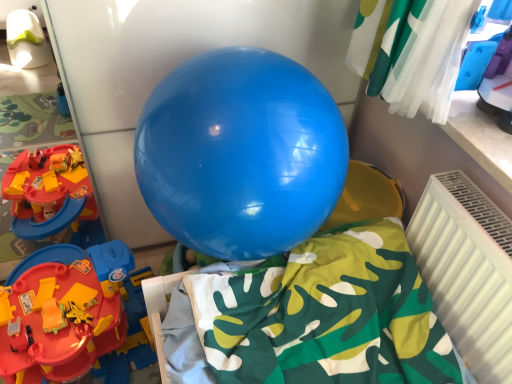
Question: Is white plastic radiator at lower right to the left of rubberized plastic track at left from the viewer's perspective?

Choices:
 (A) yes
 (B) no

Answer: (B)

Question: Is white plastic radiator at lower right at the right side of rubberized plastic track at left?

Choices:
 (A) yes
 (B) no

Answer: (A)

Question: Is white plastic radiator at lower right further to the viewer compared to rubberized plastic track at left?

Choices:
 (A) no
 (B) yes

Answer: (A)

Question: Considering the relative sizes of white plastic radiator at lower right and rubberized plastic track at left in the image provided, is white plastic radiator at lower right taller than rubberized plastic track at left?

Choices:
 (A) no
 (B) yes

Answer: (B)

Question: Is white plastic radiator at lower right not within rubberized plastic track at left?

Choices:
 (A) yes
 (B) no

Answer: (A)

Question: Can you confirm if white plastic radiator at lower right is bigger than rubberized plastic track at left?

Choices:
 (A) no
 (B) yes

Answer: (A)

Question: From the image's perspective, is glossy blue balloon at center below rubberized plastic track at left?

Choices:
 (A) no
 (B) yes

Answer: (A)

Question: Is glossy blue balloon at center thinner than rubberized plastic track at left?

Choices:
 (A) no
 (B) yes

Answer: (B)

Question: Considering the relative sizes of glossy blue balloon at center and rubberized plastic track at left in the image provided, is glossy blue balloon at center taller than rubberized plastic track at left?

Choices:
 (A) yes
 (B) no

Answer: (A)

Question: Would you consider glossy blue balloon at center to be distant from rubberized plastic track at left?

Choices:
 (A) yes
 (B) no

Answer: (B)

Question: From a real-world perspective, is glossy blue balloon at center beneath rubberized plastic track at left?

Choices:
 (A) no
 (B) yes

Answer: (A)

Question: Would you say glossy blue balloon at center contains rubberized plastic track at left?

Choices:
 (A) yes
 (B) no

Answer: (B)

Question: Is rubberized plastic track at left located outside white plastic radiator at lower right?

Choices:
 (A) no
 (B) yes

Answer: (B)